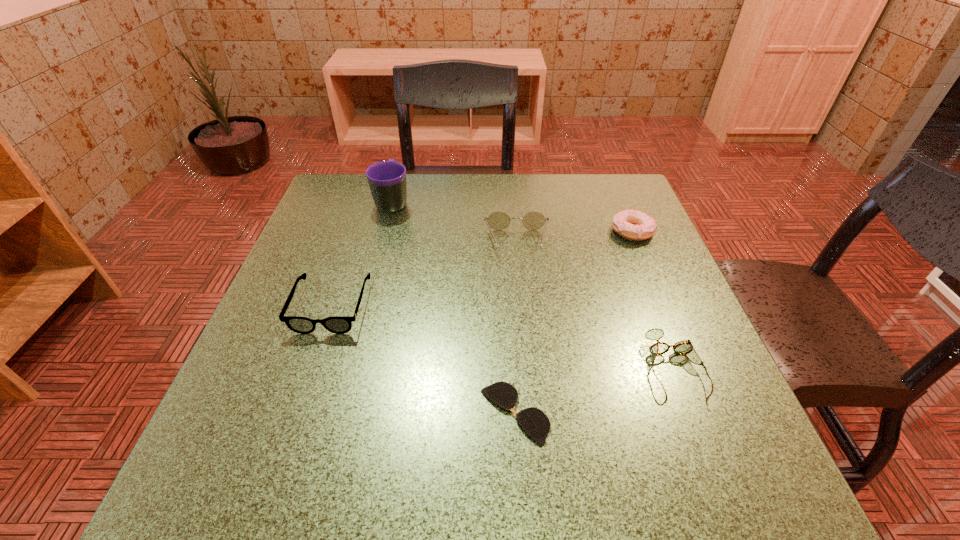
At what (x,y) coordinates should I click in order to perform the action: click on the farthest object. Please return your answer as a coordinate pair (x, y). Looking at the image, I should click on (387, 179).

This screenshot has width=960, height=540. Find the location of `the tallest object`. the tallest object is located at coordinates (387, 179).

The height and width of the screenshot is (540, 960). In order to click on the farthest spectacles in this screenshot , I will do click(x=534, y=220).

Identify the location of the second tallest spectacles. Image resolution: width=960 pixels, height=540 pixels. (337, 324).

You are a GUI agent. You are given a task and a screenshot of the screen. Output one action in this format:
    pyautogui.click(x=<x>, y=<y>)
    Task: Click on the leftmost spectacles
    The image size is (960, 540).
    Given the screenshot: What is the action you would take?
    pyautogui.click(x=337, y=324)

This screenshot has width=960, height=540. Find the location of `doughnut`. doughnut is located at coordinates (632, 224).

Find the location of a particular element. The width and height of the screenshot is (960, 540). the rightmost spectacles is located at coordinates (685, 348).

Locate an element on the screen. the shortest spectacles is located at coordinates (536, 424).

Locate an element on the screen. The image size is (960, 540). free spot located on the front-facing side of the farthest spectacles is located at coordinates [x=527, y=352].

Image resolution: width=960 pixels, height=540 pixels. Find the location of `vacant space situated on the arms of the fourth farthest object`. vacant space situated on the arms of the fourth farthest object is located at coordinates (314, 360).